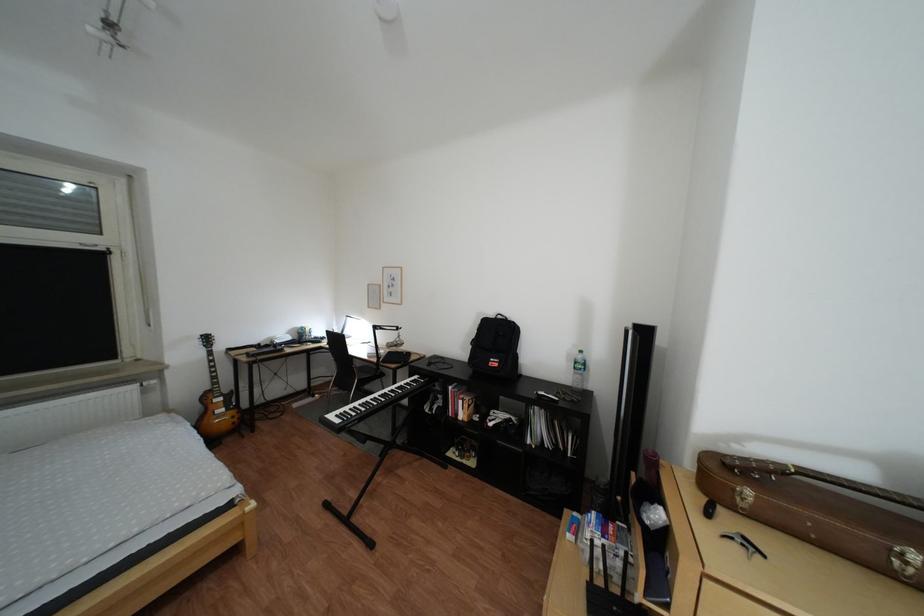
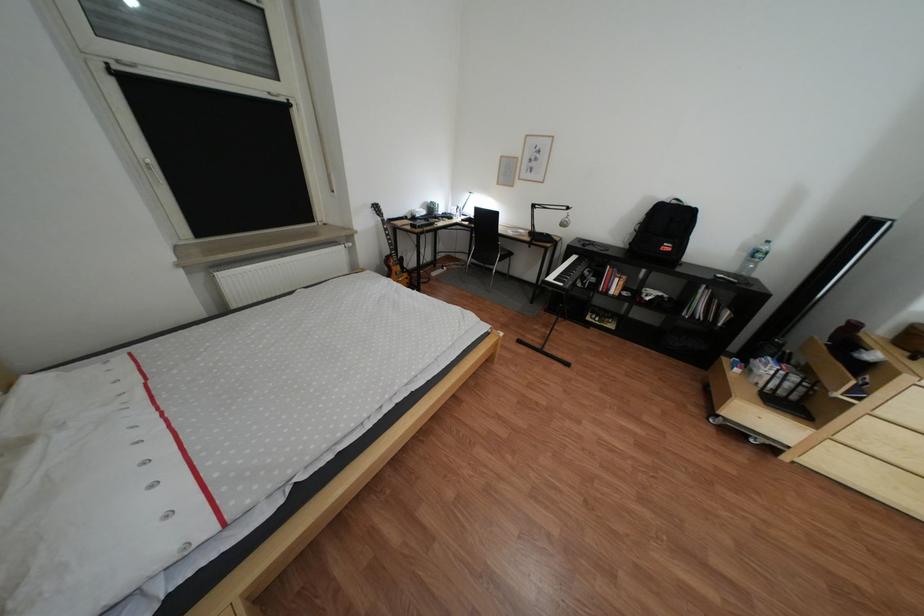
Where in the second image is the point corresponding to the point at 445,365 from the first image?

(600, 246)